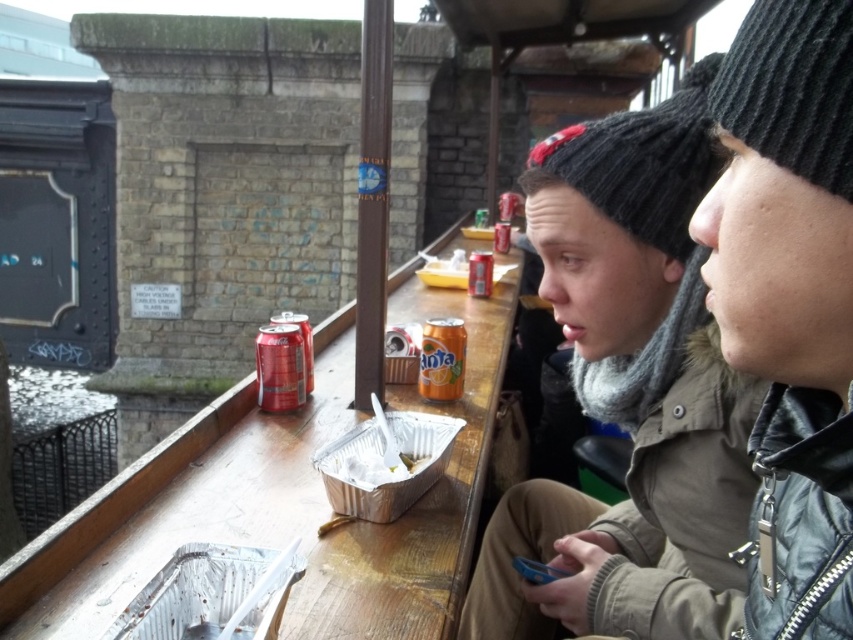
Who is lower down, wooden table at center or black knitted hat at upper right?

wooden table at center is below.

Who is more forward, (x=494, y=300) or (x=839, y=68)?

Positioned in front is point (x=839, y=68).

Where is `wooden table at center`? The width and height of the screenshot is (853, 640). wooden table at center is located at coordinates (279, 500).

Who is more distant from viewer, (769,136) or (570,176)?

Point (570,176)

Does black knitted hat at upper right have a larger size compared to black knitted hat at center?

No, black knitted hat at upper right is not bigger than black knitted hat at center.

Find the location of `black knitted hat at upper right`. black knitted hat at upper right is located at coordinates (792, 88).

Find the location of `black knitted hat at upper right`. black knitted hat at upper right is located at coordinates (792, 88).

How far apart are knitted woolen hat at upper right and black knitted hat at upper right?

knitted woolen hat at upper right is 22.18 inches from black knitted hat at upper right.

The height and width of the screenshot is (640, 853). I want to click on knitted woolen hat at upper right, so click(x=630, y=392).

Is point (590, 284) in front of point (758, 150)?

No, (590, 284) is further to viewer.

Identify the location of knitted woolen hat at upper right. The width and height of the screenshot is (853, 640). (630, 392).